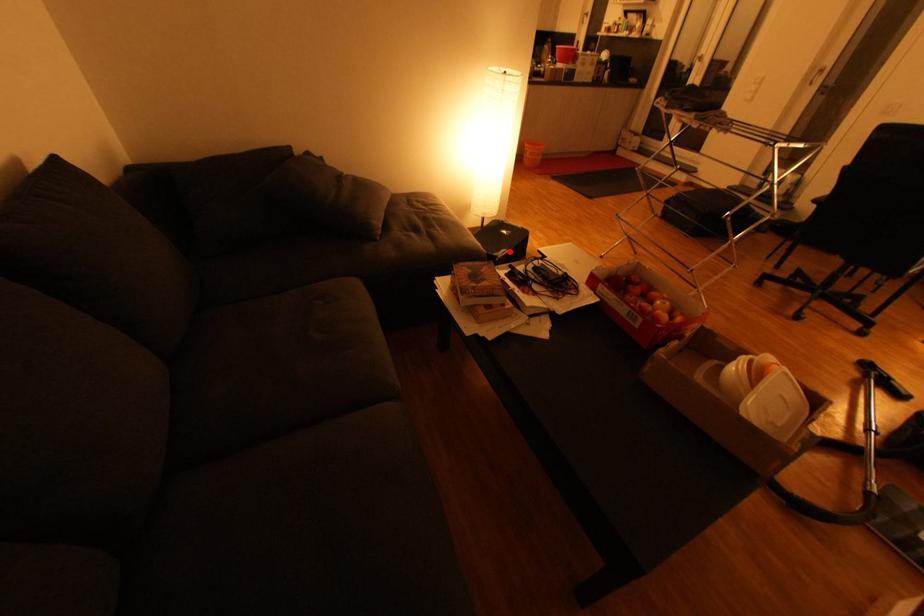
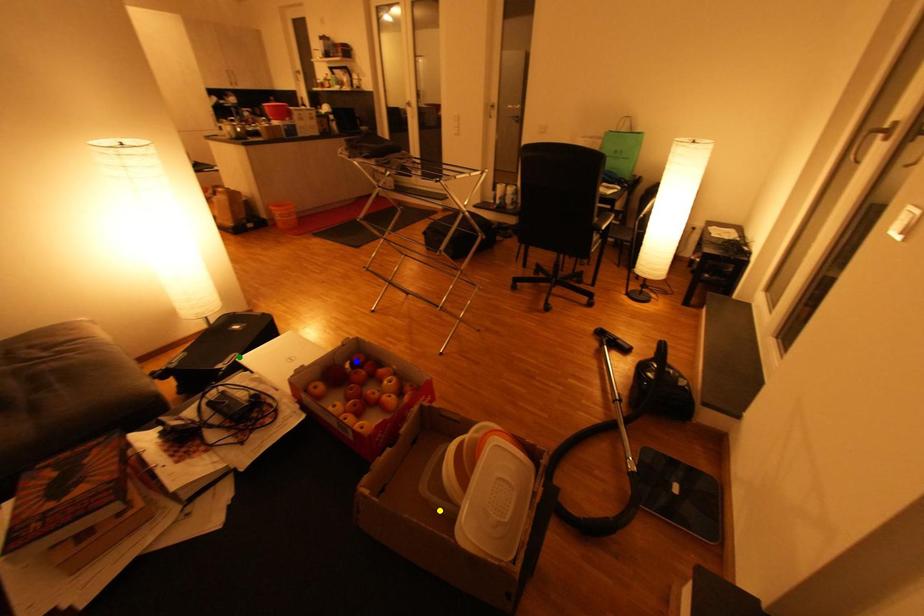
Question: I am providing you with two images of the same scene from different viewpoints. A red point is marked on the first image. You are given multiple points on the second image. Which mark in image 2 goes with the point in image 1?

Choices:
 (A) green point
 (B) blue point
 (C) yellow point

Answer: (A)